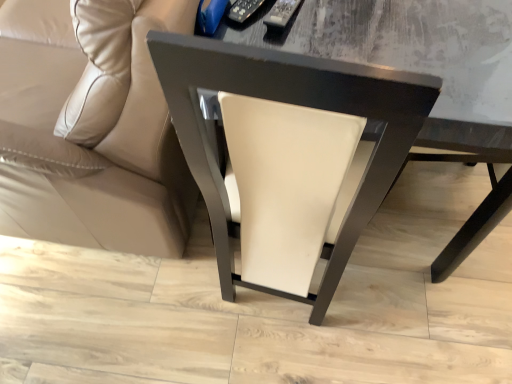
The width and height of the screenshot is (512, 384). Find the location of `white leather chair at center`. white leather chair at center is located at coordinates (292, 102).

The height and width of the screenshot is (384, 512). Describe the element at coordinates (292, 102) in the screenshot. I see `white leather chair at center` at that location.

Where is `beige leather couch at lower left`? The width and height of the screenshot is (512, 384). beige leather couch at lower left is located at coordinates (95, 135).

The height and width of the screenshot is (384, 512). What do you see at coordinates (95, 135) in the screenshot?
I see `beige leather couch at lower left` at bounding box center [95, 135].

Locate an element on the screen. This screenshot has height=384, width=512. white leather chair at center is located at coordinates (292, 102).

Between white leather chair at center and beige leather couch at lower left, which one appears on the right side from the viewer's perspective?

white leather chair at center is more to the right.

Considering their positions, is white leather chair at center located in front of or behind beige leather couch at lower left?

Clearly, white leather chair at center is behind beige leather couch at lower left.

Considering the positions of point (195, 136) and point (109, 248), is point (195, 136) closer or farther from the camera than point (109, 248)?

Clearly, point (195, 136) is closer to the camera than point (109, 248).

From the image's perspective, relative to beige leather couch at lower left, is white leather chair at center above or below?

Clearly, from the image's perspective, white leather chair at center is below beige leather couch at lower left.

From a real-world perspective, is white leather chair at center on beige leather couch at lower left?

Incorrect, from a real-world perspective, white leather chair at center is lower than beige leather couch at lower left.

Considering the sizes of objects white leather chair at center and beige leather couch at lower left in the image provided, who is wider, white leather chair at center or beige leather couch at lower left?

beige leather couch at lower left is wider.

Considering the sizes of objects white leather chair at center and beige leather couch at lower left in the image provided, who is shorter, white leather chair at center or beige leather couch at lower left?

white leather chair at center is shorter.

From the picture: Can you confirm if white leather chair at center is smaller than beige leather couch at lower left?

Yes.

Looking at this image, is white leather chair at center spatially inside beige leather couch at lower left, or outside of it?

white leather chair at center is spatially situated outside beige leather couch at lower left.

Is white leather chair at center with beige leather couch at lower left?

No.

Is white leather chair at center turned away from beige leather couch at lower left?

Yes, white leather chair at center is positioned with its back facing beige leather couch at lower left.

Locate an element on the screen. studio couch in front of the white leather chair at center is located at coordinates (95, 135).

Does beige leather couch at lower left appear on the right side of white leather chair at center?

No, beige leather couch at lower left is not to the right of white leather chair at center.

Which object is more forward, beige leather couch at lower left or white leather chair at center?

beige leather couch at lower left.

Does point (143, 144) come closer to viewer compared to point (336, 68)?

No, it is not.

From the image's perspective, relative to white leather chair at center, is beige leather couch at lower left above or below?

From the image's perspective, beige leather couch at lower left appears above white leather chair at center.

From a real-world perspective, who is located lower, beige leather couch at lower left or white leather chair at center?

white leather chair at center.

Between beige leather couch at lower left and white leather chair at center, which one has smaller width?

Thinner between the two is white leather chair at center.

Can you confirm if beige leather couch at lower left is taller than white leather chair at center?

Yes.

Consider the image. In terms of size, does beige leather couch at lower left appear bigger or smaller than white leather chair at center?

Clearly, beige leather couch at lower left is larger in size than white leather chair at center.

Is beige leather couch at lower left completely or partially outside of white leather chair at center?

Yes, beige leather couch at lower left is not within white leather chair at center.

Is beige leather couch at lower left with white leather chair at center?

No, beige leather couch at lower left is not next to white leather chair at center.

Could you tell me if beige leather couch at lower left is turned towards white leather chair at center?

No.

How different are the orientations of beige leather couch at lower left and white leather chair at center in degrees?

The angular difference between beige leather couch at lower left and white leather chair at center is 180 degrees.

What are the coordinates of `studio couch in front of the white leather chair at center` in the screenshot? It's located at (95, 135).

The height and width of the screenshot is (384, 512). What are the coordinates of `studio couch in front of the white leather chair at center` in the screenshot? It's located at (95, 135).

Where is `chair below the beige leather couch at lower left (from the image's perspective)`? chair below the beige leather couch at lower left (from the image's perspective) is located at coordinates (292, 102).